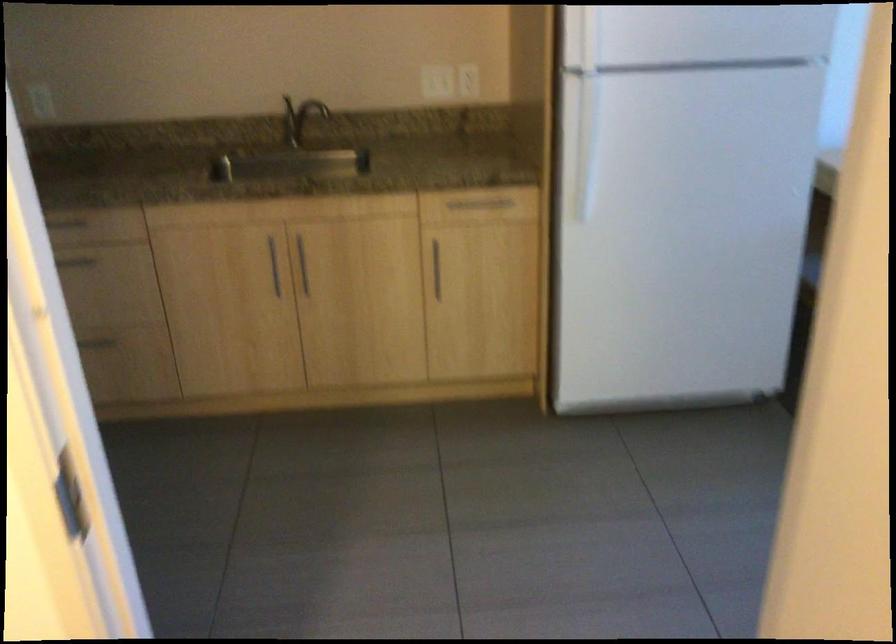
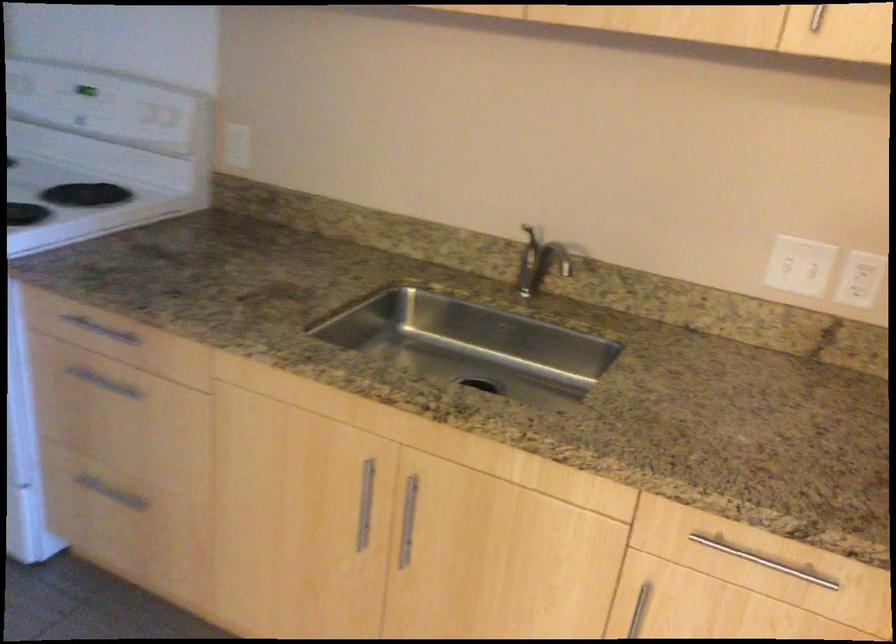
Locate, in the second image, the point that corresponds to point (440, 84) in the first image.

(798, 266)